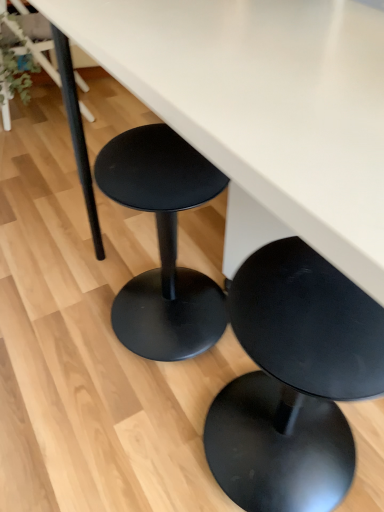
Question: From the image's perspective, is green matte plant at upper left located above or below matte black stool at upper left?

Choices:
 (A) below
 (B) above

Answer: (A)

Question: Is point (6, 82) closer or farther from the camera than point (86, 111)?

Choices:
 (A) farther
 (B) closer

Answer: (B)

Question: Which of these objects is positioned farthest from the green matte plant at upper left?

Choices:
 (A) matte black stool at lower center
 (B) matte black stool at lower center
 (C) matte black stool at upper left

Answer: (B)

Question: Estimate the real-world distances between objects in this image. Which object is farther from the matte black stool at lower center?

Choices:
 (A) matte black stool at upper left
 (B) green matte plant at upper left
 (C) matte black stool at lower center

Answer: (A)